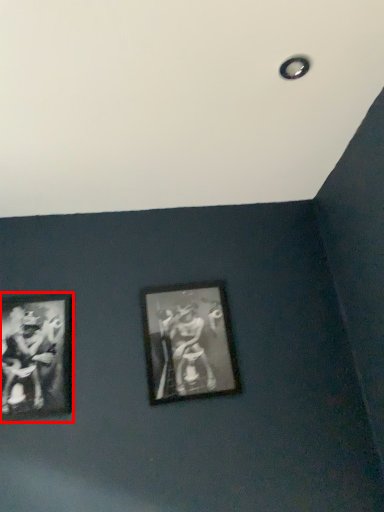
Question: From the image's perspective, where is picture frame (annotated by the red box) located in relation to picture frame in the image?

Choices:
 (A) above
 (B) below

Answer: (B)